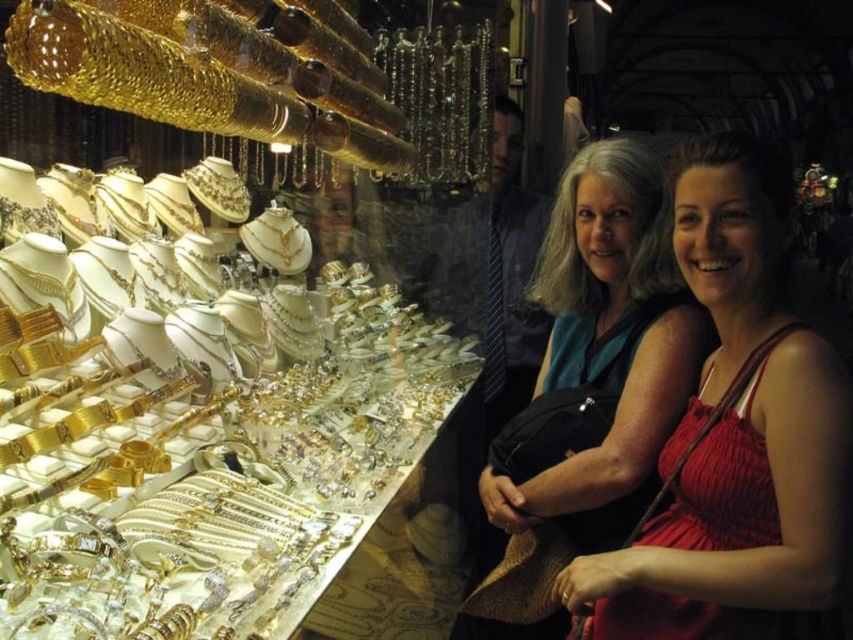
Question: Does gold shiny jewelry at left appear on the right side of matte teal dress at center?

Choices:
 (A) no
 (B) yes

Answer: (A)

Question: Can you confirm if gold shiny jewelry at left is positioned to the left of matte teal dress at center?

Choices:
 (A) no
 (B) yes

Answer: (B)

Question: Which object is positioned closest to the matte red dress at center?

Choices:
 (A) gold shiny jewelry at left
 (B) matte teal dress at center

Answer: (B)

Question: Among these objects, which one is nearest to the camera?

Choices:
 (A) gold shiny jewelry at left
 (B) matte red dress at center

Answer: (A)

Question: Which object is closer to the camera taking this photo?

Choices:
 (A) matte teal dress at center
 (B) gold shiny jewelry at left
 (C) matte red dress at center

Answer: (B)

Question: Is matte red dress at center to the left of matte teal dress at center from the viewer's perspective?

Choices:
 (A) yes
 (B) no

Answer: (B)